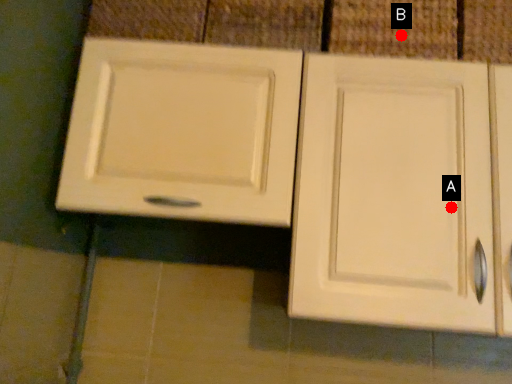
Question: Two points are circled on the image, labeled by A and B beside each circle. Which point is farther from the camera taking this photo?

Choices:
 (A) A is further
 (B) B is further

Answer: (B)